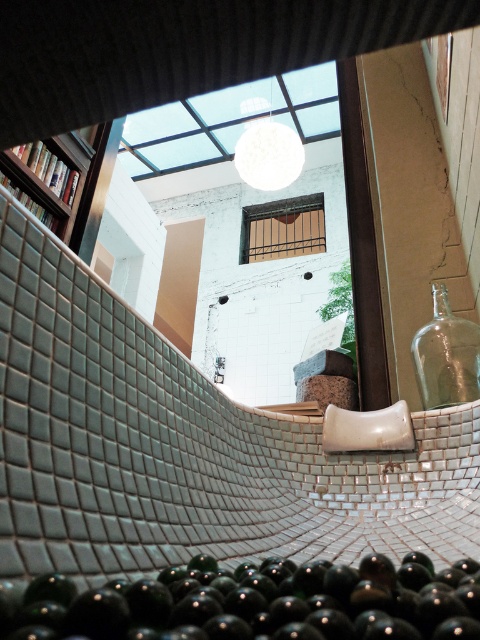
Image resolution: width=480 pixels, height=640 pixels. What do you see at coordinates (48, 177) in the screenshot?
I see `wooden bookshelf at upper left` at bounding box center [48, 177].

Is point (17, 168) farther from viewer compared to point (420, 392)?

Yes, it is.

Identify the location of wooden bookshelf at upper left. The width and height of the screenshot is (480, 640). (48, 177).

Locate an element on the screen. The width and height of the screenshot is (480, 640). wooden bookshelf at upper left is located at coordinates (48, 177).

Which is in front, point (127, 637) or point (60, 136)?

Point (127, 637)

This screenshot has height=640, width=480. What do you see at coordinates (255, 602) in the screenshot?
I see `green glass bottle at bottom` at bounding box center [255, 602].

Between point (339, 577) and point (81, 189), which one is positioned behind?

Positioned behind is point (81, 189).

Find the location of a particular element. Image resolution: width=480 pixels, height=640 pixels. green glass bottle at bottom is located at coordinates (255, 602).

Who is more distant from viewer, (49, 600) or (425, 388)?

Positioned behind is point (425, 388).

Is point (43, 604) behind point (459, 384)?

No, it is in front of (459, 384).

Image resolution: width=480 pixels, height=640 pixels. I want to click on green glass bottle at bottom, so click(x=255, y=602).